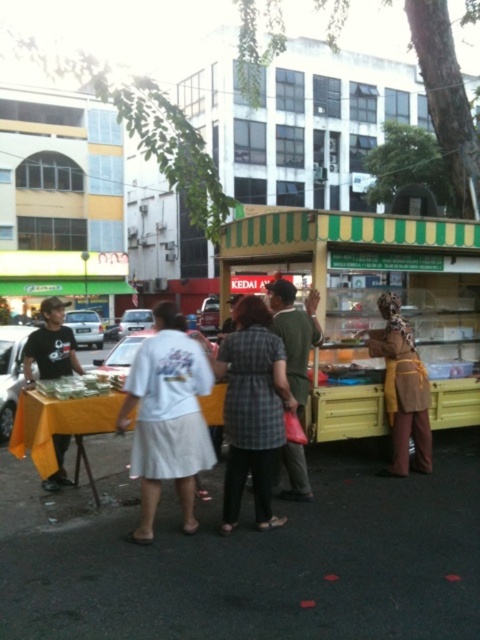
Is yellow-green striped awning at center taller than white cotton shirt at center?

No, yellow-green striped awning at center is not taller than white cotton shirt at center.

Who is lower down, yellow-green striped awning at center or white cotton shirt at center?

white cotton shirt at center is lower down.

Which is in front, point (457, 301) or point (188, 520)?

Point (188, 520) is more forward.

Locate an element on the screen. This screenshot has width=480, height=640. yellow-green striped awning at center is located at coordinates [x=372, y=301].

Can you confirm if plaid fabric shirt at center is wider than matte black t-shirt at left?

Incorrect, plaid fabric shirt at center's width does not surpass matte black t-shirt at left's.

Who is lower down, plaid fabric shirt at center or matte black t-shirt at left?

plaid fabric shirt at center is below.

Find the location of `plaid fabric shirt at center`. plaid fabric shirt at center is located at coordinates (252, 408).

Who is more distant from viewer, (345, 323) or (248, 397)?

The point (345, 323) is behind.

Based on the photo, can you confirm if yellow-green striped awning at center is smaller than plaid fabric shirt at center?

Correct, yellow-green striped awning at center occupies less space than plaid fabric shirt at center.

Between point (257, 266) and point (271, 472), which one is positioned behind?

Positioned behind is point (257, 266).

Identify the location of yellow-green striped awning at center. (372, 301).